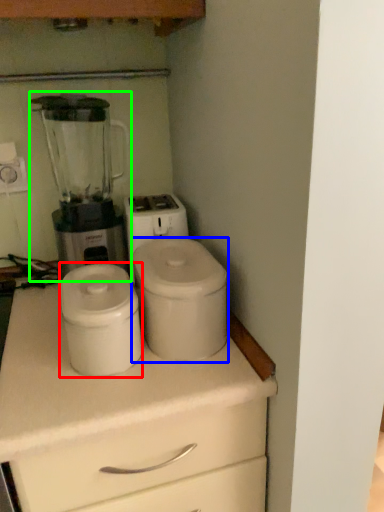
Question: Estimate the real-world distances between objects in this image. Which object is farther from appliance (highlighted by a red box), appliance (highlighted by a blue box) or blender (highlighted by a green box)?

Choices:
 (A) appliance
 (B) blender

Answer: (B)